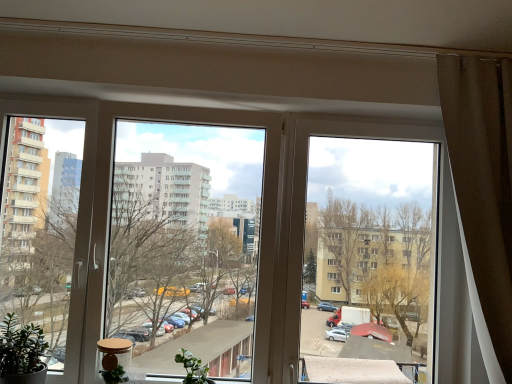
Question: From the image's perspective, is brown fabric curtain at right located above or below green matte plant at lower center, marked as the first plant in a right-to-left arrangement?

Choices:
 (A) above
 (B) below

Answer: (A)

Question: Based on their positions, is brown fabric curtain at right located to the left or right of green matte plant at lower center, marked as the first plant in a right-to-left arrangement?

Choices:
 (A) right
 (B) left

Answer: (A)

Question: Which of these objects is positioned closest to the transparent glass window at center, the 1th window from the right?

Choices:
 (A) green matte plant at lower center, marked as the first plant in a right-to-left arrangement
 (B) green matte plant at lower left, placed as the second plant when sorted from right to left
 (C) brown fabric curtain at right
 (D) transparent plastic window at center, the 1th window when ordered from left to right

Answer: (C)

Question: Considering the real-world distances, which object is closest to the transparent glass window at center, acting as the second window starting from the left?

Choices:
 (A) green matte plant at lower center, marked as the first plant in a right-to-left arrangement
 (B) brown fabric curtain at right
 (C) transparent plastic window at center, which is counted as the 2th window, starting from the right
 (D) green matte plant at lower left, placed as the second plant when sorted from right to left

Answer: (B)